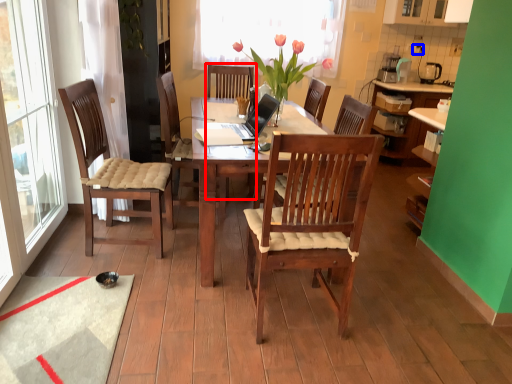
Question: Which point is further to the camera, armchair (highlighted by a red box) or power outlet (highlighted by a blue box)?

Choices:
 (A) armchair
 (B) power outlet

Answer: (B)